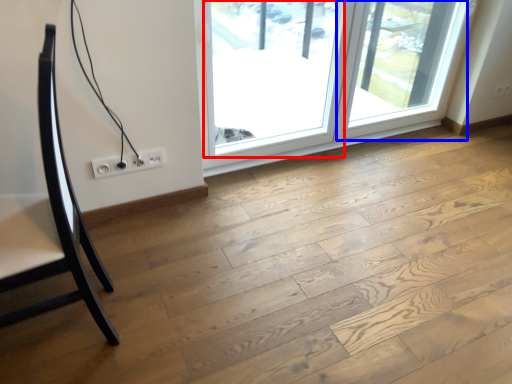
Question: Among these objects, which one is farthest to the camera, window (highlighted by a red box) or screen door (highlighted by a blue box)?

Choices:
 (A) window
 (B) screen door

Answer: (B)